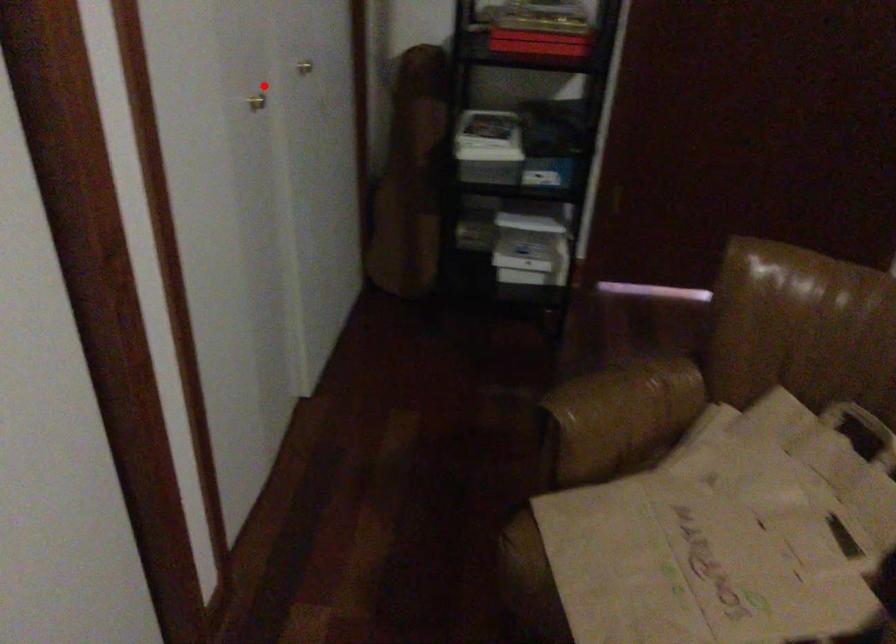
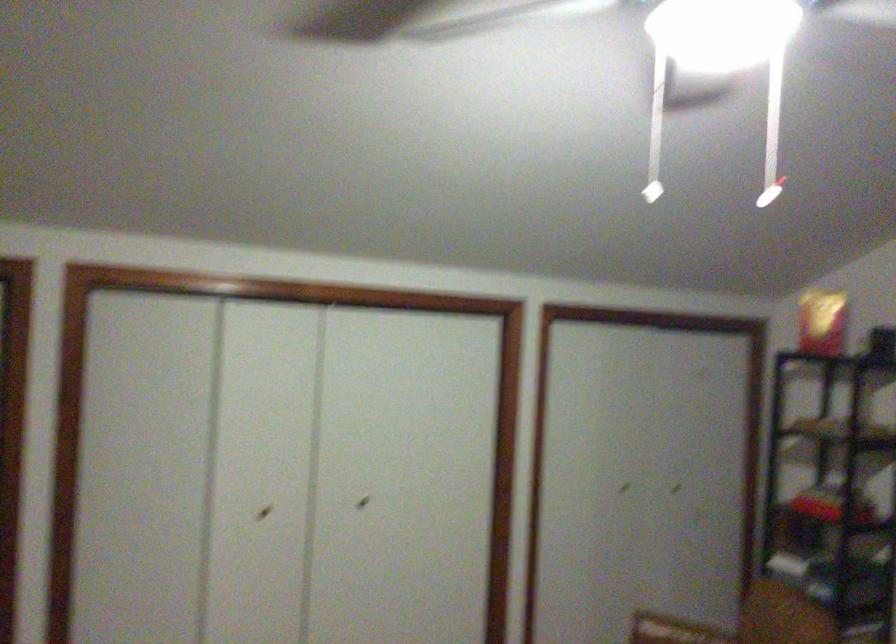
Question: I am providing you with two images of the same scene from different viewpoints. Image1 has a red point marked. In image2, the corresponding 3D location appears at what relative position? Reply with the corresponding letter.

Choices:
 (A) Closer
 (B) Farther

Answer: (B)